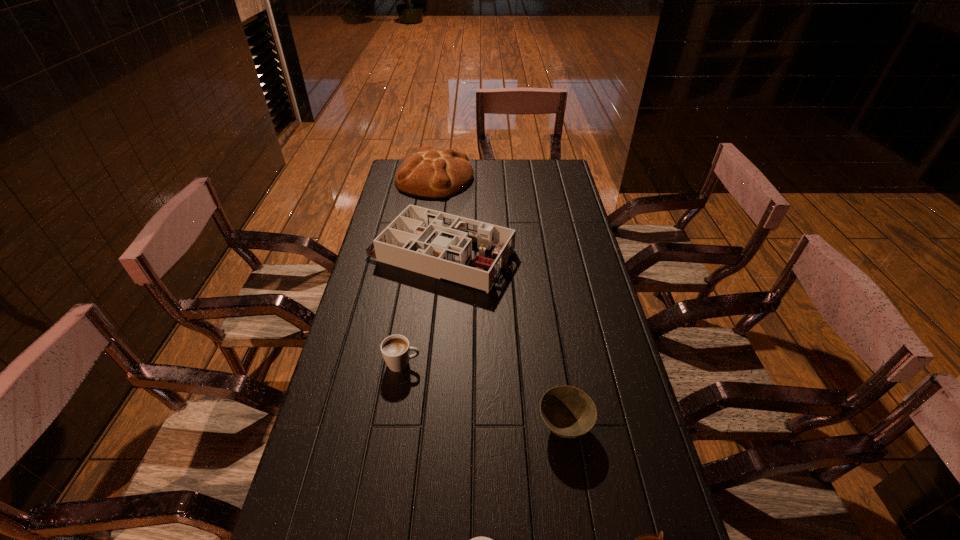
Locate an element on the screen. The image size is (960, 540). free space between the fifth object from left to right and the dollhouse is located at coordinates (503, 340).

You are a GUI agent. You are given a task and a screenshot of the screen. Output one action in this format:
    pyautogui.click(x=<x>, y=<y>)
    Task: Click on the free space between the fifth object from left to right and the tallest cappuccino
    The image size is (960, 540).
    Given the screenshot: What is the action you would take?
    pyautogui.click(x=484, y=395)

Find the location of a particular element. free space between the third farthest object and the dollhouse is located at coordinates pyautogui.click(x=422, y=308).

Identify which object is located as the nearest to the dollhouse. Please provide its 2D coordinates. Your answer should be formatted as a tuple, i.e. [(x, y)], where the tuple contains the x and y coordinates of a point satisfying the conditions above.

[(429, 173)]

Where is `object that stands as the fourth closest to the rightmost object`? The height and width of the screenshot is (540, 960). object that stands as the fourth closest to the rightmost object is located at coordinates (437, 244).

Where is `the closest cappuccino to the second farthest object`? the closest cappuccino to the second farthest object is located at coordinates coord(395,349).

Point out which cappuccino is positioned as the nearest to the rightmost object. Please provide its 2D coordinates. Your answer should be formatted as a tuple, i.e. [(x, y)], where the tuple contains the x and y coordinates of a point satisfying the conditions above.

[(477, 539)]

The image size is (960, 540). I want to click on free region that satisfies the following two spatial constraints: 1. on the back side of the second object from right to left; 2. with the handle on the side of the third farthest object, so click(x=555, y=363).

This screenshot has width=960, height=540. I want to click on vacant space that satisfies the following two spatial constraints: 1. on the front side of the farthest object; 2. with the handle on the side of the third farthest object, so click(x=407, y=363).

Where is `vacant space that satisfies the following two spatial constraints: 1. on the back side of the third nearest object; 2. with the handle on the side of the farthest cappuccino`? vacant space that satisfies the following two spatial constraints: 1. on the back side of the third nearest object; 2. with the handle on the side of the farthest cappuccino is located at coordinates (555, 363).